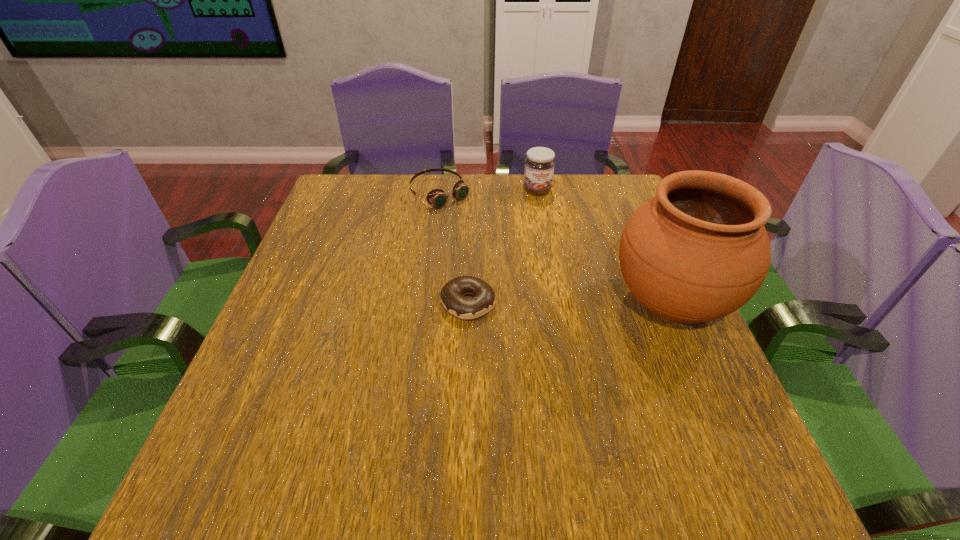
This screenshot has height=540, width=960. What are the coordinates of `the shortest object` in the screenshot? It's located at (452, 294).

Identify the location of the rightmost object. (697, 251).

I want to click on the tallest object, so click(x=697, y=251).

Find the location of a particular element. the second object from right to left is located at coordinates (539, 164).

The image size is (960, 540). I want to click on jam, so click(539, 164).

Locate an element on the screen. Image resolution: width=960 pixels, height=540 pixels. goggles is located at coordinates (437, 197).

Where is `free space located 0.240m on the back of the shortest object`? This screenshot has width=960, height=540. free space located 0.240m on the back of the shortest object is located at coordinates (470, 222).

Locate an element on the screen. This screenshot has height=540, width=960. blank space located 0.180m on the front of the tallest object is located at coordinates (729, 439).

This screenshot has width=960, height=540. I want to click on vacant space located 0.350m on the front label of the third shortest object, so click(570, 281).

Locate an element on the screen. The height and width of the screenshot is (540, 960). vacant space situated on the front label of the third shortest object is located at coordinates (546, 214).